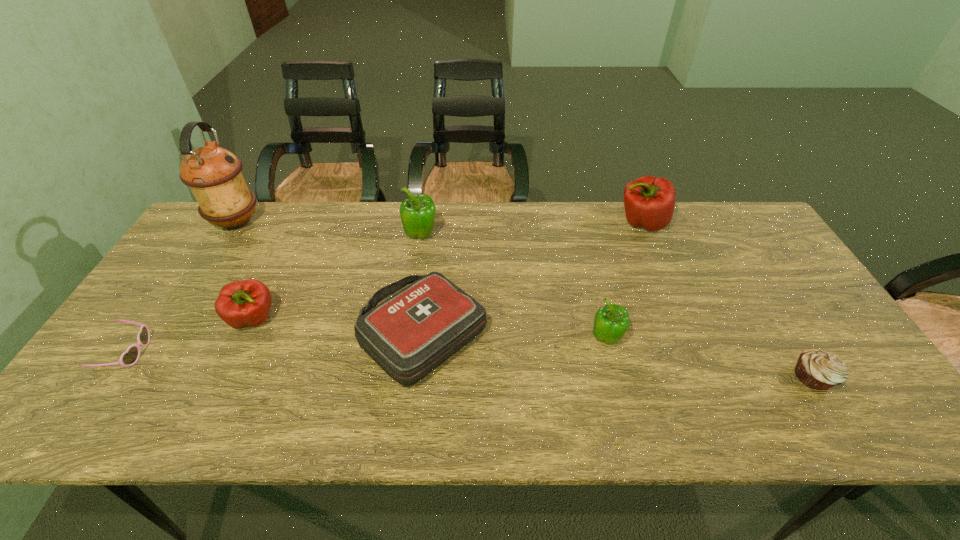
I want to click on red first-aid kit, so click(x=409, y=335).

At what (x,y) coordinates should I click in order to perform the action: click on the rightmost object. Please return your answer as a coordinate pair (x, y). This screenshot has height=540, width=960. Looking at the image, I should click on (817, 369).

Locate an element on the screen. This screenshot has width=960, height=540. muffin is located at coordinates (817, 369).

You are a GUI agent. You are given a task and a screenshot of the screen. Output one action in this format:
    pyautogui.click(x=<x>, y=<y>)
    Task: Click on the sunglasses
    The width and height of the screenshot is (960, 540).
    Given the screenshot: What is the action you would take?
    pyautogui.click(x=130, y=357)

The width and height of the screenshot is (960, 540). What are the coordinates of `pink sunglasses` in the screenshot? It's located at (130, 357).

Image resolution: width=960 pixels, height=540 pixels. In order to click on free space located on the right of the oil lamp in this screenshot , I will do `click(317, 222)`.

In order to click on free region located 0.080m on the back of the left green bell pepper in this screenshot , I will do `click(424, 210)`.

Where is `free space located 0.160m on the right of the right pink bell pepper`? Image resolution: width=960 pixels, height=540 pixels. free space located 0.160m on the right of the right pink bell pepper is located at coordinates (717, 223).

The width and height of the screenshot is (960, 540). I want to click on vacant position located on the back of the sixth object from left to right, so click(585, 253).

This screenshot has height=540, width=960. What are the coordinates of `free spot located 0.200m on the front of the leftmost bell pepper` in the screenshot? It's located at (210, 413).